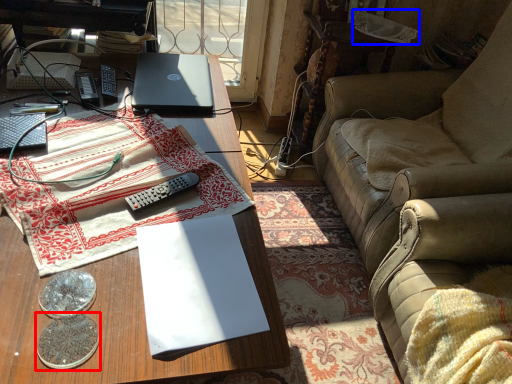
Question: Which object appears farthest to the camera in this image, coin (highlighted by a red box) or fabric (highlighted by a blue box)?

Choices:
 (A) coin
 (B) fabric

Answer: (B)